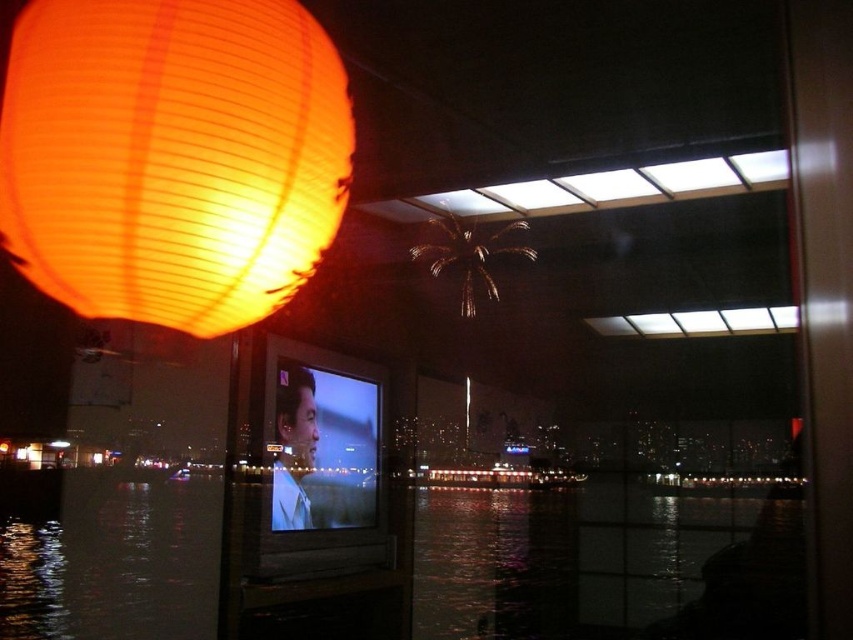
Question: Is matte paper lantern at upper left to the right of metallic gold palm tree at upper center from the viewer's perspective?

Choices:
 (A) yes
 (B) no

Answer: (B)

Question: Does transparent glass water at center have a smaller size compared to matte paper lantern at upper left?

Choices:
 (A) no
 (B) yes

Answer: (A)

Question: Which object is closer to the camera taking this photo?

Choices:
 (A) transparent glass water at center
 (B) matte paper lantern at upper left

Answer: (B)

Question: Is transparent glass water at center to the left of matte paper lantern at upper left from the viewer's perspective?

Choices:
 (A) yes
 (B) no

Answer: (B)

Question: Which point is closer to the camera?

Choices:
 (A) (476, 260)
 (B) (78, 477)
 (C) (48, 83)

Answer: (C)

Question: Estimate the real-world distances between objects in this image. Which object is closer to the metallic gold palm tree at upper center?

Choices:
 (A) transparent glass water at center
 (B) matte paper lantern at upper left

Answer: (A)